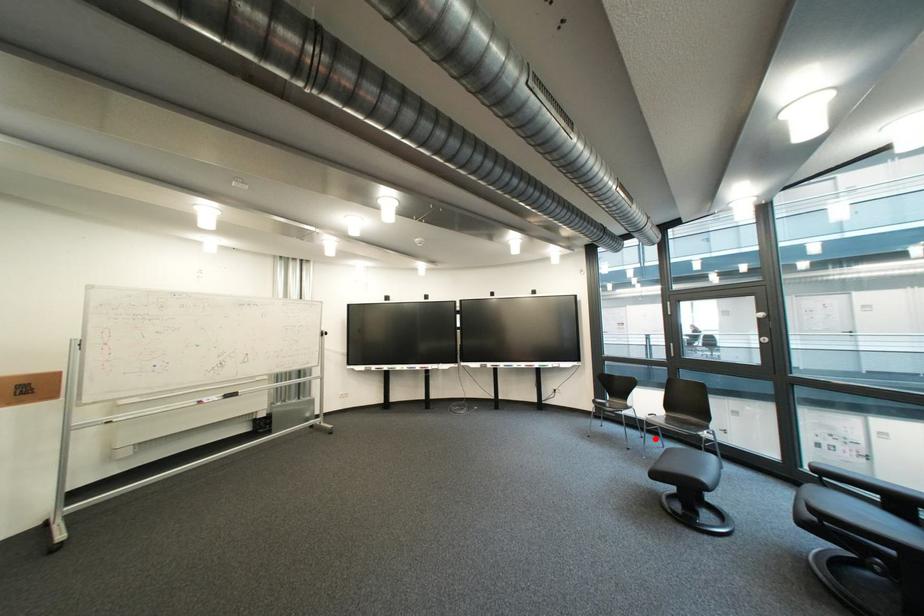
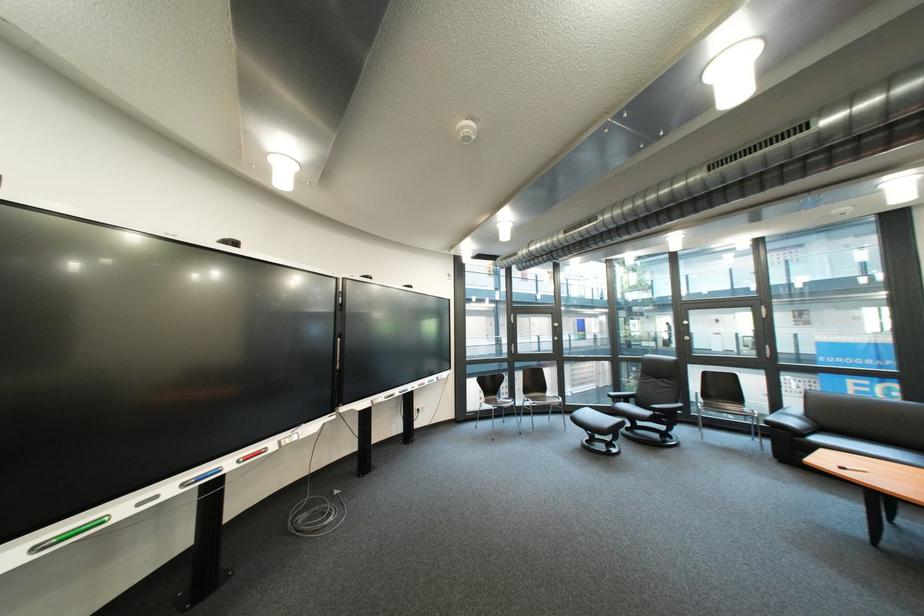
Question: I am providing you with two images of the same scene from different viewpoints. In image1, a red point is highlighted. Considering the same 3D point in image2, which of the following is correct?

Choices:
 (A) It is closer
 (B) It is farther

Answer: (B)